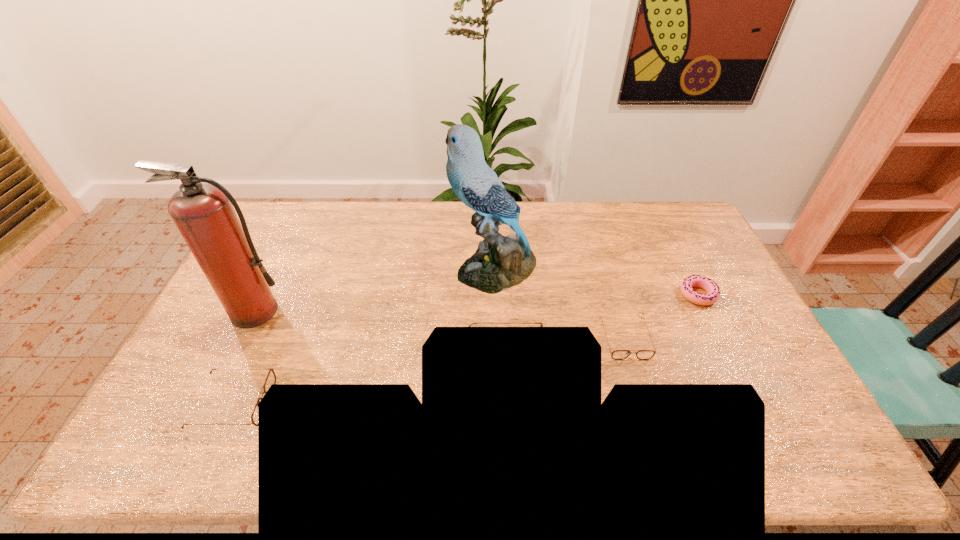
Find the location of a particular element. The image size is (960, 540). vacant space located on the front-facing side of the third tallest object is located at coordinates (666, 359).

Identify the location of vacant position located on the front-facing side of the shortest sunglasses. (646, 410).

At what (x,y) coordinates should I click in order to perform the action: click on vacant area situated 0.320m on the face of the parakeet. Please return your answer as a coordinate pair (x, y). Looking at the image, I should click on (357, 269).

At what (x,y) coordinates should I click in order to perform the action: click on vacant space situated 0.380m on the face of the parakeet. Please return your answer as a coordinate pair (x, y). The height and width of the screenshot is (540, 960). Looking at the image, I should click on (339, 269).

The width and height of the screenshot is (960, 540). In order to click on free space located on the face of the parakeet in this screenshot , I will do `click(339, 269)`.

Locate an element on the screen. This screenshot has height=540, width=960. vacant region located at the nozzle of the fire extinguisher is located at coordinates (209, 406).

What are the coordinates of `free space located on the left of the rightmost object` in the screenshot? It's located at (661, 295).

Locate an element on the screen. This screenshot has height=540, width=960. sunglasses present at the left edge is located at coordinates (271, 377).

The width and height of the screenshot is (960, 540). I want to click on fire extinguisher located in the left edge section of the desktop, so coord(203,213).

The height and width of the screenshot is (540, 960). In order to click on object situated at the right edge in this screenshot , I will do `click(710, 287)`.